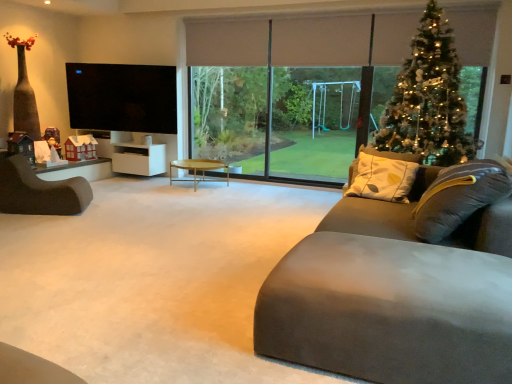
Identify the location of free space to the right of dark brown leather chair at left. (114, 212).